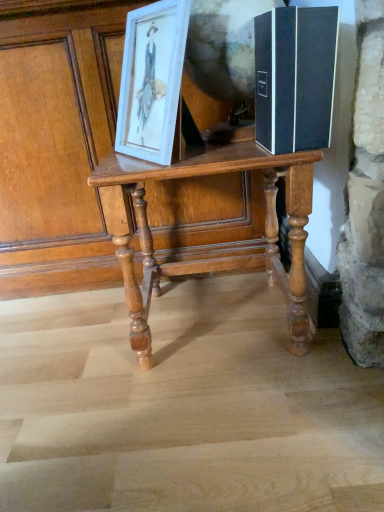
The width and height of the screenshot is (384, 512). I want to click on free point below wooden table at center (from a real-world perspective), so 209,323.